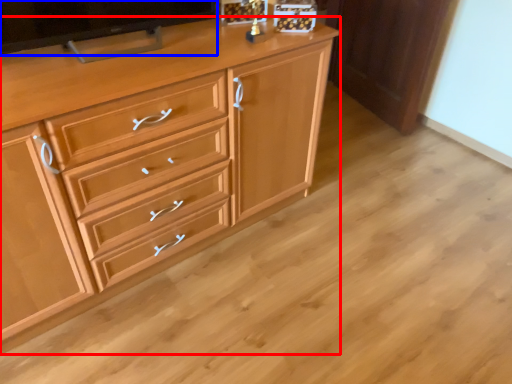
Question: Which point is further to the camera, chest of drawers (highlighted by a red box) or television (highlighted by a blue box)?

Choices:
 (A) chest of drawers
 (B) television

Answer: (B)